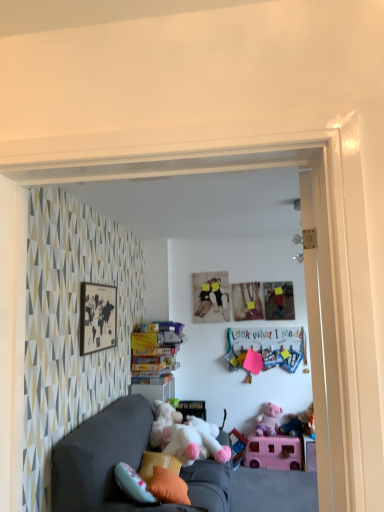
The image size is (384, 512). What are the coordinates of `velvet dark gray couch at center` in the screenshot? It's located at (125, 462).

Describe the element at coordinates (97, 317) in the screenshot. The image size is (384, 512). I see `matte black map at upper left` at that location.

What is the approximate height of fluffy white plush at center, positioned as the 4th toy in back-to-front order?

fluffy white plush at center, positioned as the 4th toy in back-to-front order, is 30.21 centimeters tall.

What are the coordinates of `fluffy white plush at center, the first toy positioned from the front` in the screenshot? It's located at (194, 441).

This screenshot has width=384, height=512. What are the coordinates of `orange fabric pillow at lower center, the first pillow when ordered from front to back` in the screenshot? It's located at (168, 486).

Measure the distance between orange fabric pillow at lower center, the first pillow when ordered from front to back, and camera.

A distance of 7.79 feet exists between orange fabric pillow at lower center, the first pillow when ordered from front to back, and camera.

Image resolution: width=384 pixels, height=512 pixels. What are the coordinates of `velvet dark gray couch at center` in the screenshot? It's located at (125, 462).

Can you confirm if purple plush bear at lower right, the first toy from the back, is positioned to the left of matte pink paper at upper center?

In fact, purple plush bear at lower right, the first toy from the back, is to the right of matte pink paper at upper center.

Between purple plush bear at lower right, the first toy from the back, and matte pink paper at upper center, which one has smaller size?

matte pink paper at upper center.

Considering the relative sizes of purple plush bear at lower right, the fourth toy in the front-to-back sequence, and matte pink paper at upper center in the image provided, is purple plush bear at lower right, the fourth toy in the front-to-back sequence, wider than matte pink paper at upper center?

Yes.

Between point (273, 411) and point (248, 333), which one is positioned behind?

Point (248, 333)

From the image's perspective, is matte black map at upper left below velvet dark gray couch at center?

No, from the image's perspective, matte black map at upper left is not below velvet dark gray couch at center.

Is matte black map at upper left bigger than velvet dark gray couch at center?

Actually, matte black map at upper left might be smaller than velvet dark gray couch at center.

From the picture: How different are the orientations of matte black map at upper left and velvet dark gray couch at center in degrees?

0.107 degrees separate the facing orientations of matte black map at upper left and velvet dark gray couch at center.

Is point (89, 338) closer or farther from the camera than point (210, 490)?

Point (89, 338) is positioned farther from the camera compared to point (210, 490).

From a real-world perspective, which object stands above the other?

In real-world perspective, fluffy white plush at center, positioned as the 4th toy in back-to-front order, is above.

Is fluffy white plush at center, the first toy positioned from the front, outside of velvet dark gray couch at center?

No, fluffy white plush at center, the first toy positioned from the front, is not entirely external to velvet dark gray couch at center.

In order to click on toy located above the velvet dark gray couch at center (from the image's perspective) in this screenshot , I will do `click(194, 441)`.

Consider the image. From the image's perspective, does fluffy white plush at center, the first toy positioned from the front, appear higher than velvet dark gray couch at center?

Yes.

Is fluffy white plush at center, positioned as the 4th toy in back-to-front order, facing towards fluffy pink teddy bear at lower right, placed as the third toy when sorted from front to back?

No, fluffy white plush at center, positioned as the 4th toy in back-to-front order, is not facing towards fluffy pink teddy bear at lower right, placed as the third toy when sorted from front to back.

Is fluffy white plush at center, the first toy positioned from the front, inside or outside of fluffy pink teddy bear at lower right, placed as the third toy when sorted from front to back?

The correct answer is: outside.

Find the location of a particular element. This screenshot has width=384, height=512. the 3rd toy to the right of the fluffy white plush at center, positioned as the 4th toy in back-to-front order, starting your count from the anchor is located at coordinates (299, 423).

Can you confirm if fluffy white plush at center, the first toy positioned from the front, is positioned to the left of fluffy pink teddy bear at lower right, placed as the third toy when sorted from front to back?

Correct, you'll find fluffy white plush at center, the first toy positioned from the front, to the left of fluffy pink teddy bear at lower right, placed as the third toy when sorted from front to back.

Visually, is orange fabric pillow at lower center, the first pillow when ordered from front to back, positioned to the left or to the right of pink plastic toy car at lower right, which is the 2th toy in front-to-back order?

From the image, it's evident that orange fabric pillow at lower center, the first pillow when ordered from front to back, is to the left of pink plastic toy car at lower right, which is the 2th toy in front-to-back order.

Can we say orange fabric pillow at lower center, the first pillow when ordered from front to back, lies outside pink plastic toy car at lower right, which ranks as the third toy in back-to-front order?

Yes, orange fabric pillow at lower center, the first pillow when ordered from front to back, is not within pink plastic toy car at lower right, which ranks as the third toy in back-to-front order.

Is orange fabric pillow at lower center, the 2th pillow from the back, facing away from pink plastic toy car at lower right, which is the 2th toy in front-to-back order?

No.

From the image's perspective, which one is positioned higher, orange fabric pillow at lower center, the first pillow when ordered from front to back, or pink plastic toy car at lower right, which is the 2th toy in front-to-back order?

orange fabric pillow at lower center, the first pillow when ordered from front to back, from the image's perspective.

Find the location of a particular element. bulletin board above the matte gray couch at lower center (from the image's perspective) is located at coordinates (267, 348).

Is matte pink paper at upper center looking in the opposite direction of matte gray couch at lower center?

matte pink paper at upper center is not turned away from matte gray couch at lower center.

Can you see matte pink paper at upper center touching matte gray couch at lower center?

No, matte pink paper at upper center is not beside matte gray couch at lower center.

Looking at their sizes, would you say fluffy white plush at center, the first toy positioned from the front, is wider or thinner than matte gray couch at lower center?

fluffy white plush at center, the first toy positioned from the front, is thinner than matte gray couch at lower center.

Is fluffy white plush at center, positioned as the 4th toy in back-to-front order, taller or shorter than matte gray couch at lower center?

fluffy white plush at center, positioned as the 4th toy in back-to-front order, is taller than matte gray couch at lower center.

From a real-world perspective, who is located lower, fluffy white plush at center, positioned as the 4th toy in back-to-front order, or matte gray couch at lower center?

matte gray couch at lower center is physically lower.

Relative to matte gray couch at lower center, is fluffy white plush at center, positioned as the 4th toy in back-to-front order, in front or behind?

fluffy white plush at center, positioned as the 4th toy in back-to-front order, is in front of matte gray couch at lower center.

The image size is (384, 512). Find the location of `the 1st toy to the right of the matte pink paper at upper center, counting from the anchor's position`. the 1st toy to the right of the matte pink paper at upper center, counting from the anchor's position is located at coordinates (268, 421).

Locate an element on the screen. The width and height of the screenshot is (384, 512). studio couch in front of the matte black map at upper left is located at coordinates pos(125,462).

Considering their positions, is fluffy pink teddy bear at lower right, placed as the third toy when sorted from front to back, positioned closer to velvet dark gray couch at center than purple plush bear at lower right, the first toy from the back?

Based on the image, purple plush bear at lower right, the first toy from the back, appears to be nearer to velvet dark gray couch at center.

Estimate the real-world distances between objects in this image. Which object is further from orange fabric pillow at lower center, acting as the second pillow starting from the front, matte pink paper at upper center or pink plastic toy car at lower right, which ranks as the third toy in back-to-front order?

matte pink paper at upper center lies further to orange fabric pillow at lower center, acting as the second pillow starting from the front, than the other object.

When comparing their distances from orange fabric pillow at lower center, the 1th pillow from the back, does matte gray couch at lower center or fluffy pink teddy bear at lower right, placed as the third toy when sorted from front to back, seem closer?

matte gray couch at lower center.

When comparing their distances from matte gray couch at lower center, does orange fabric pillow at lower center, the 2th pillow from the back, or matte pink paper at upper center seem closer?

Based on the image, matte pink paper at upper center appears to be nearer to matte gray couch at lower center.

From the image, which object appears to be farther from fluffy white plush at center, positioned as the 4th toy in back-to-front order, matte black map at upper left or orange fabric pillow at lower center, acting as the second pillow starting from the front?

matte black map at upper left is further to fluffy white plush at center, positioned as the 4th toy in back-to-front order.

Considering their positions, is matte gray couch at lower center positioned further to velvet dark gray couch at center than pink plastic toy car at lower right, which is the 2th toy in front-to-back order?

pink plastic toy car at lower right, which is the 2th toy in front-to-back order, is further to velvet dark gray couch at center.

Based on their spatial positions, is pink plastic toy car at lower right, which ranks as the third toy in back-to-front order, or matte gray couch at lower center closer to fluffy white plush at center, positioned as the 4th toy in back-to-front order?

matte gray couch at lower center is closer to fluffy white plush at center, positioned as the 4th toy in back-to-front order.

Considering their positions, is orange fabric pillow at lower center, acting as the second pillow starting from the front, positioned further to velvet dark gray couch at center than fluffy pink teddy bear at lower right, which is counted as the second toy, starting from the back?

fluffy pink teddy bear at lower right, which is counted as the second toy, starting from the back, is positioned further to the anchor velvet dark gray couch at center.

Find the location of `toy between matte black map at upper left and velvet dark gray couch at center in the up-down direction`. toy between matte black map at upper left and velvet dark gray couch at center in the up-down direction is located at coordinates (194, 441).

Identify the location of toy between orange fabric pillow at lower center, acting as the second pillow starting from the front, and pink plastic toy car at lower right, which is the 2th toy in front-to-back order, along the z-axis. The width and height of the screenshot is (384, 512). (194, 441).

The width and height of the screenshot is (384, 512). In order to click on toy positioned between matte gray couch at lower center and fluffy pink teddy bear at lower right, which is counted as the second toy, starting from the back, from near to far in this screenshot , I will do `click(274, 452)`.

In order to click on toy between fluffy white plush at center, the first toy positioned from the front, and fluffy pink teddy bear at lower right, which is counted as the second toy, starting from the back, in the front-back direction in this screenshot , I will do `click(274, 452)`.